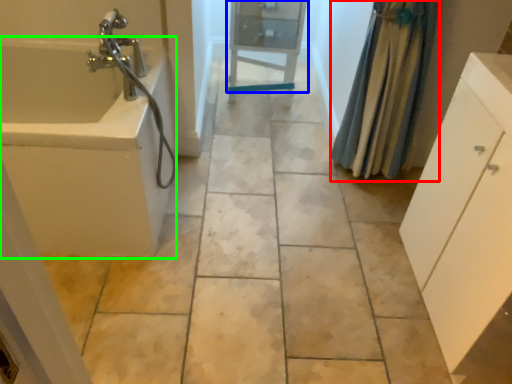
Question: Estimate the real-world distances between objects in this image. Which object is closer to shower curtain (highlighted by a red box), cabinetry (highlighted by a blue box) or bath (highlighted by a green box)?

Choices:
 (A) cabinetry
 (B) bath

Answer: (A)